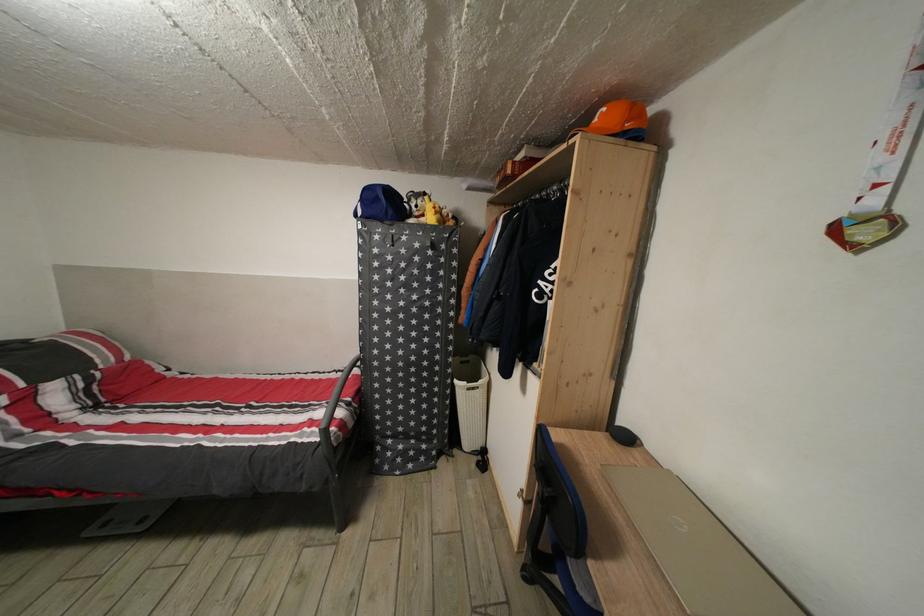
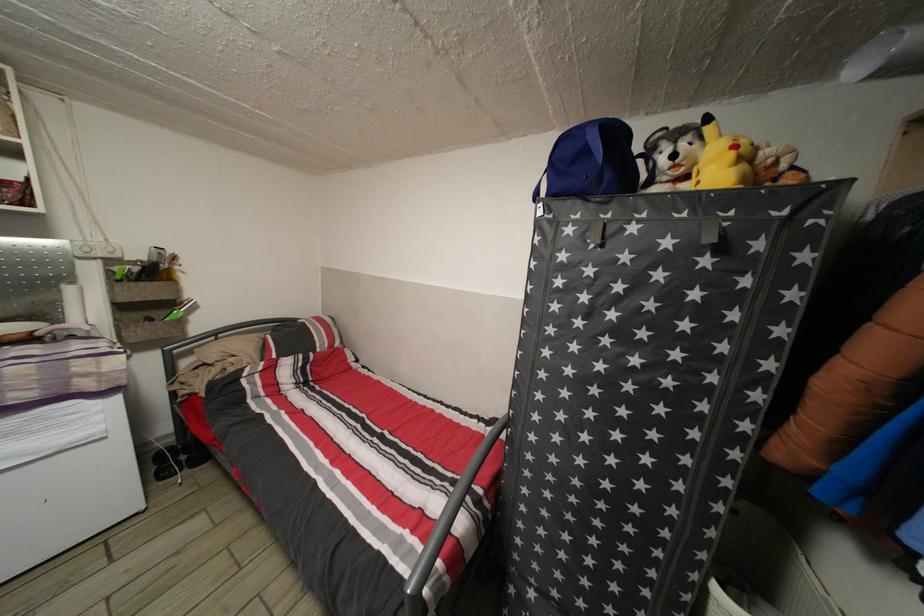
In the second image, find the point that corresponds to (384,205) in the first image.

(591, 158)